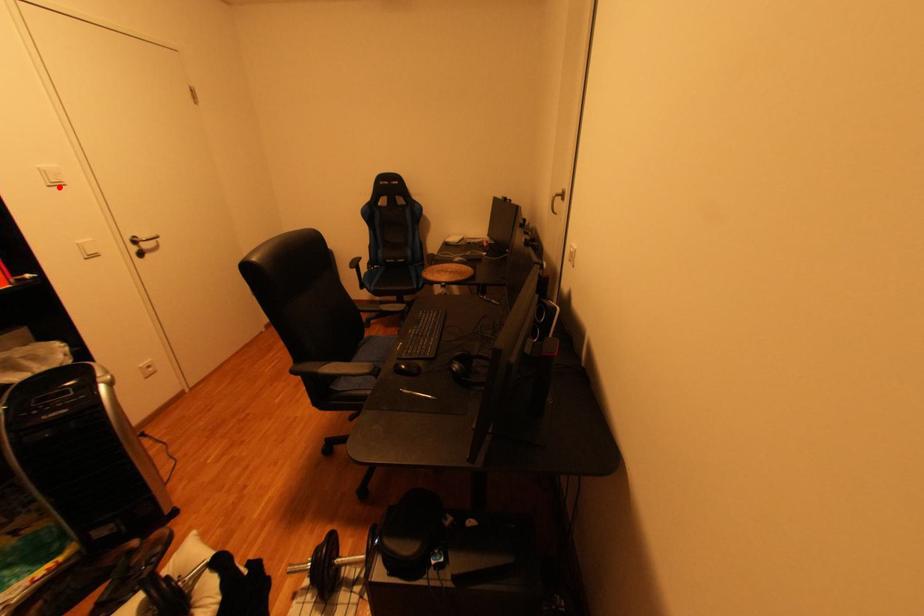
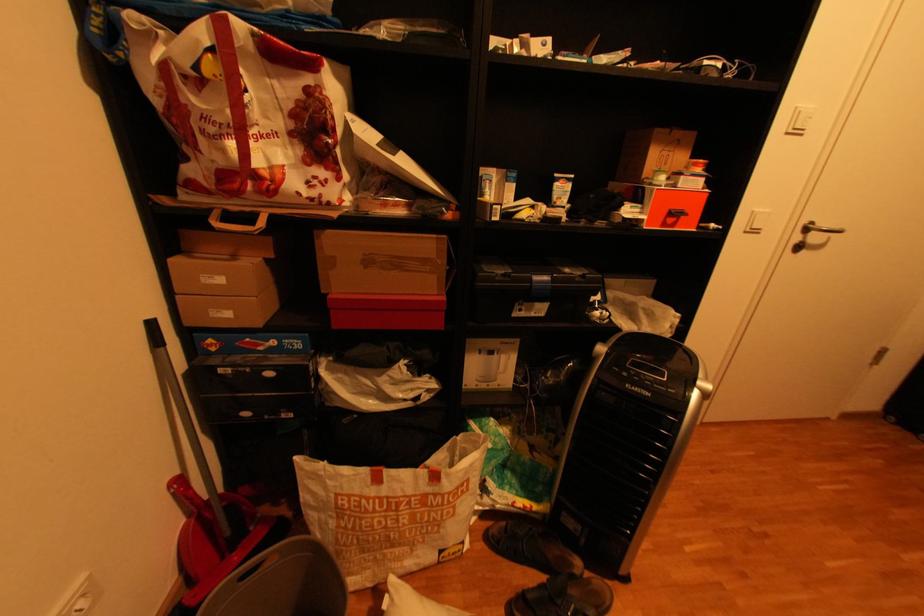
In the second image, find the point that corresponds to the highlighted location in the first image.

(796, 134)